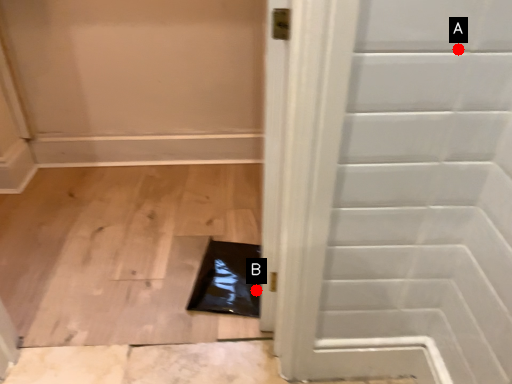
Question: Two points are circled on the image, labeled by A and B beside each circle. Which point is further to the camera?

Choices:
 (A) A is further
 (B) B is further

Answer: (B)